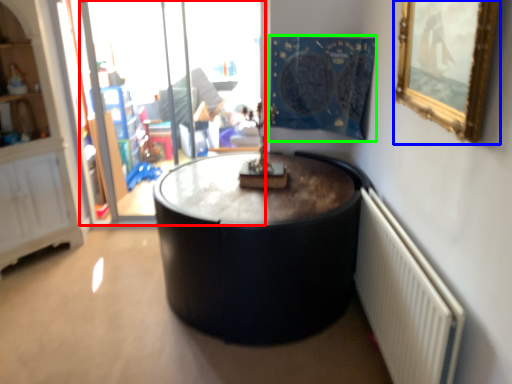
Question: Based on their relative distances, which object is farther from glass door (highlighted by a red box)? Choose from picture frame (highlighted by a blue box) and tapestry (highlighted by a green box).

Choices:
 (A) picture frame
 (B) tapestry

Answer: (A)